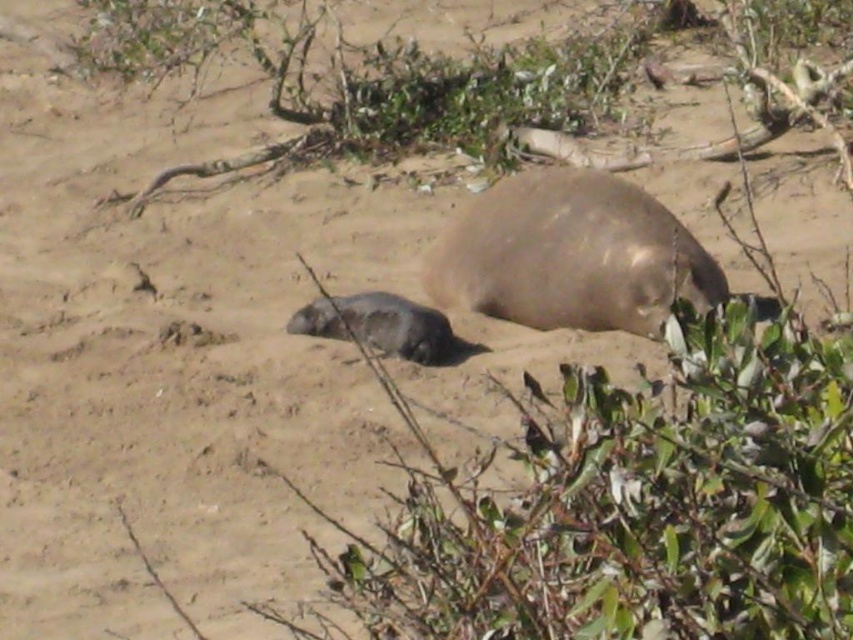
Based on the photo, you are standing at the point marked by the coordinates point (570, 256). Looking around, you see a gray fur seal at center and sparse vegetation in the foreground. Which direction should you move to reach the gray fur seal at center?

You are already at the point corresponding to the gray fur seal at center, so you don not need to move in any direction to reach it.

You are standing on the beach and see the gray fur seal at center. If you want to approach it without disturbing it, you should stay at least 6 meters away. Are you within the safe distance?

The gray fur seal at center and the viewer are 5.79 meters apart, so you are within the safe distance of 6 meters. Therefore, you should move back to maintain the required distance.